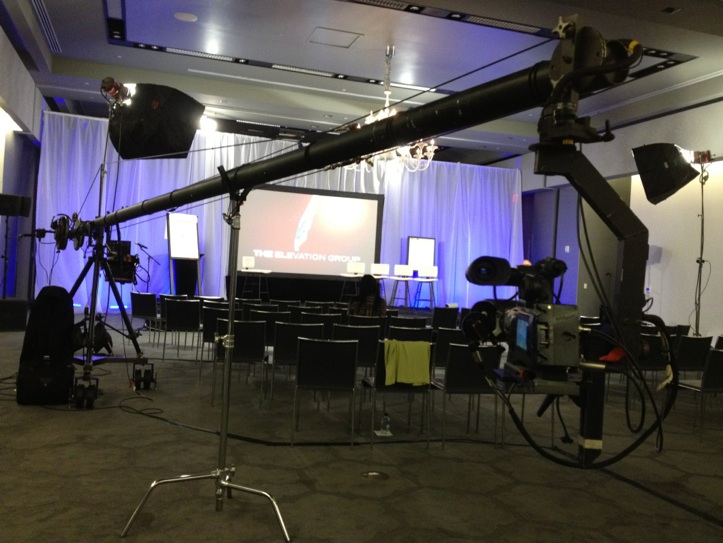
The width and height of the screenshot is (723, 543). I want to click on chair, so click(332, 358).